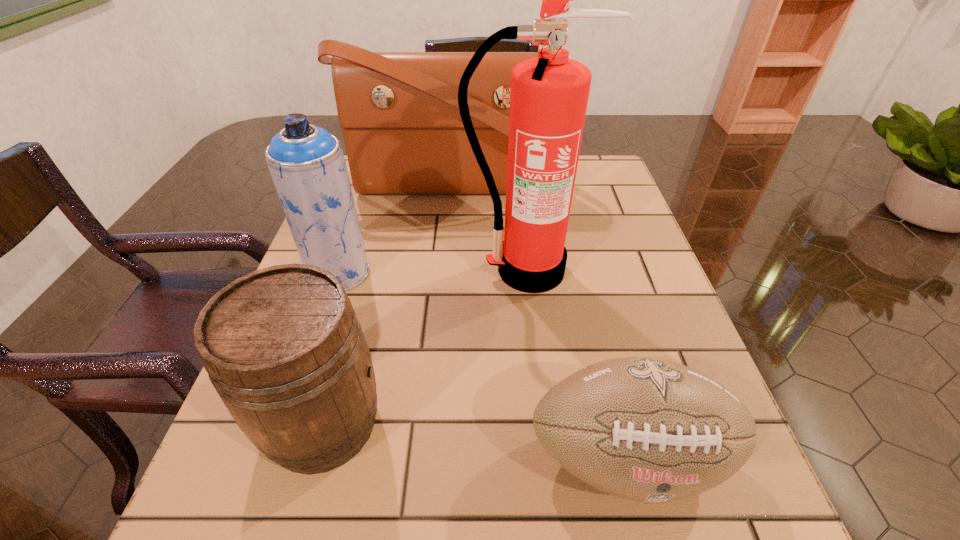
Find the location of `the tallest object`. the tallest object is located at coordinates point(549,95).

This screenshot has width=960, height=540. I want to click on the farthest object, so click(x=399, y=112).

Where is `aerosol can`? This screenshot has width=960, height=540. aerosol can is located at coordinates (307, 165).

This screenshot has height=540, width=960. I want to click on cider, so click(283, 347).

Where is `football (American)`? This screenshot has width=960, height=540. football (American) is located at coordinates (644, 429).

The width and height of the screenshot is (960, 540). In order to click on free space located with the nozzle aimed from the fire extinguisher in this screenshot , I will do `click(536, 350)`.

Identify the location of free location located 0.180m on the front flap of the satchel. (448, 257).

Image resolution: width=960 pixels, height=540 pixels. What are the coordinates of `free space located on the right of the aerosol can` in the screenshot? It's located at (433, 272).

Where is `vacant space located 0.190m on the side of the fourth tallest object near the bung hole`? This screenshot has width=960, height=540. vacant space located 0.190m on the side of the fourth tallest object near the bung hole is located at coordinates (512, 423).

Locate an element on the screen. This screenshot has width=960, height=540. object at the far edge is located at coordinates (399, 112).